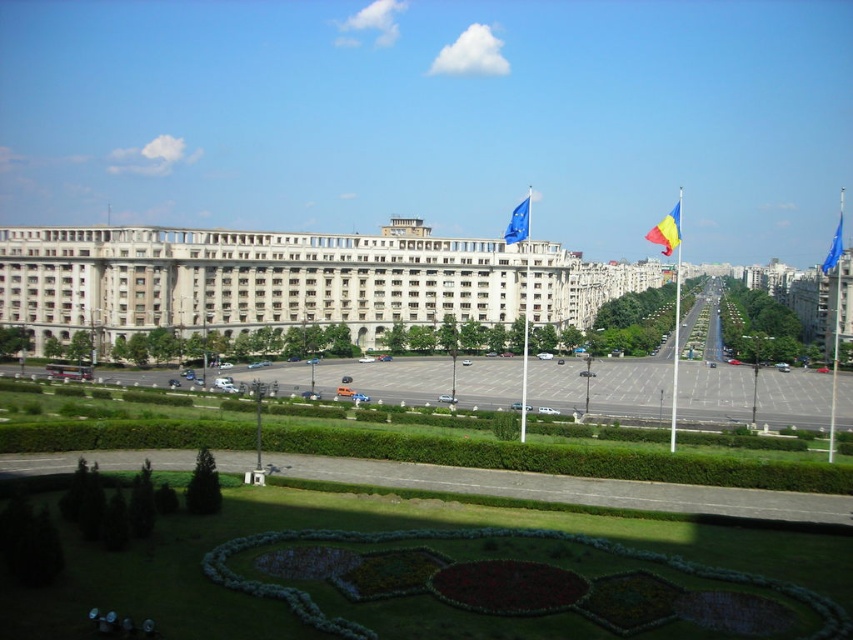
Who is taller, blue fabric flag at center or blue fabric flag at right?

Standing taller between the two is blue fabric flag at center.

Is blue fabric flag at center further to the viewer compared to blue fabric flag at right?

No, it is not.

Does point (506, 243) come in front of point (836, 225)?

Yes, it is in front of point (836, 225).

Find the location of a particular element. blue fabric flag at center is located at coordinates (518, 221).

Can you confirm if white stone building at center is positioned to the right of yellow and blue fabric flag at upper right?

No, white stone building at center is not to the right of yellow and blue fabric flag at upper right.

In the scene shown: Which of these two, white stone building at center or yellow and blue fabric flag at upper right, stands taller?

Standing taller between the two is yellow and blue fabric flag at upper right.

You are a GUI agent. You are given a task and a screenshot of the screen. Output one action in this format:
    pyautogui.click(x=<x>, y=<y>)
    Task: Click on the white stone building at center
    The width and height of the screenshot is (853, 640).
    Given the screenshot: What is the action you would take?
    (292, 282)

Who is positioned more to the right, yellow and blue fabric flag at upper right or blue fabric flag at right?

blue fabric flag at right is more to the right.

Does yellow and blue fabric flag at upper right lie in front of blue fabric flag at right?

Yes, yellow and blue fabric flag at upper right is closer to the viewer.

This screenshot has width=853, height=640. Describe the element at coordinates (666, 230) in the screenshot. I see `yellow and blue fabric flag at upper right` at that location.

Find the location of a particular element. yellow and blue fabric flag at upper right is located at coordinates (666, 230).